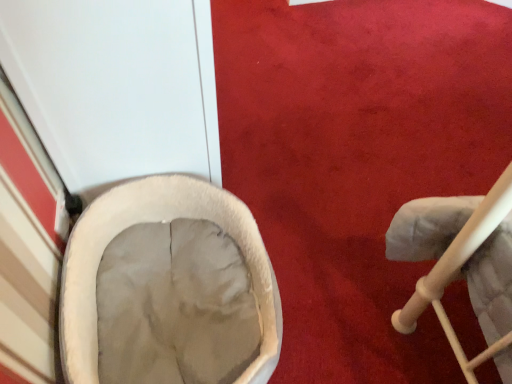
The width and height of the screenshot is (512, 384). What do you see at coordinates (157, 221) in the screenshot? I see `beige fabric bean bag at lower left` at bounding box center [157, 221].

The width and height of the screenshot is (512, 384). I want to click on beige fabric bean bag at lower left, so click(157, 221).

In order to face beige fabric bean bag at lower left, should I rotate leftwards or rightwards?

Turn left by 9.915 degrees to look at beige fabric bean bag at lower left.

This screenshot has width=512, height=384. Identify the location of beige fabric bean bag at lower left. (157, 221).